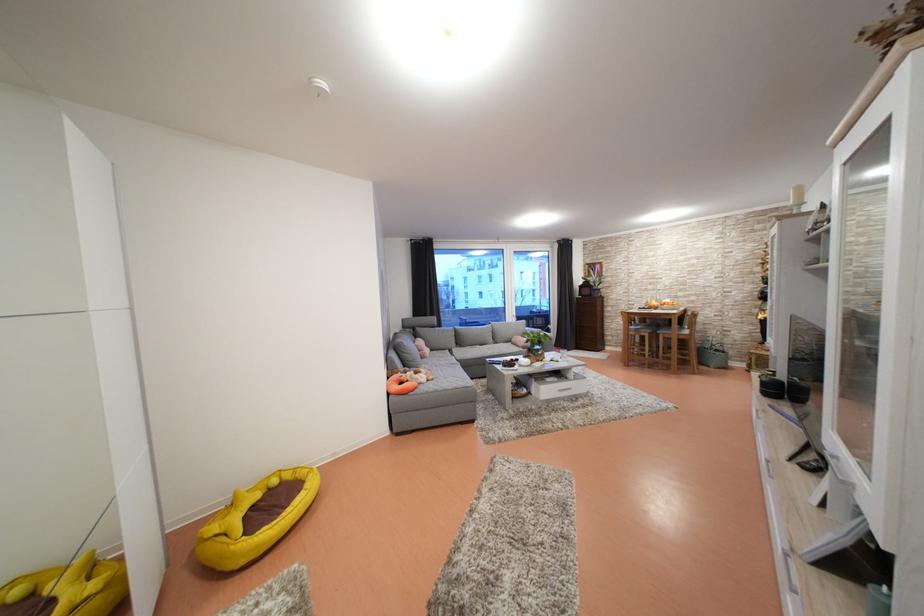
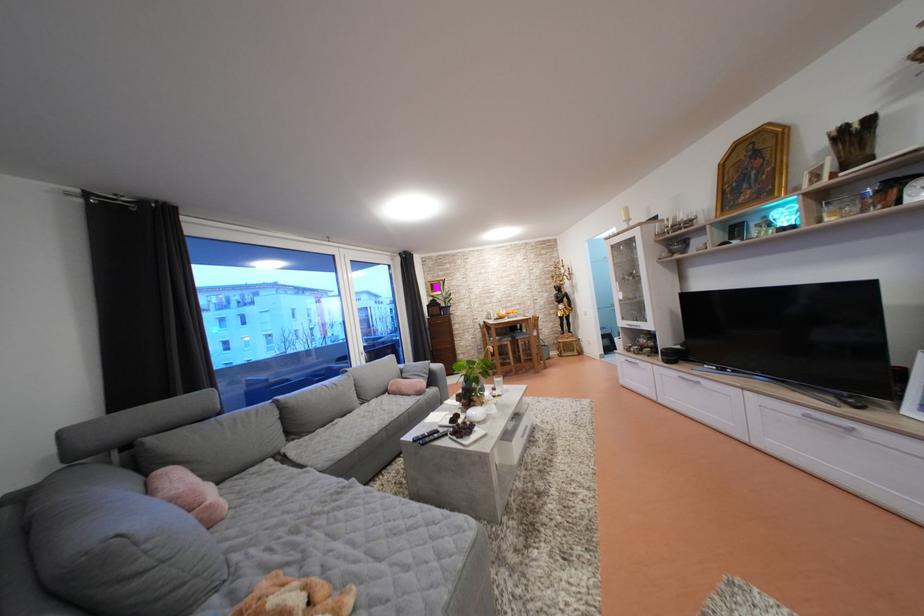
Locate, in the second image, the point that corresponds to (641,315) in the first image.

(497, 328)